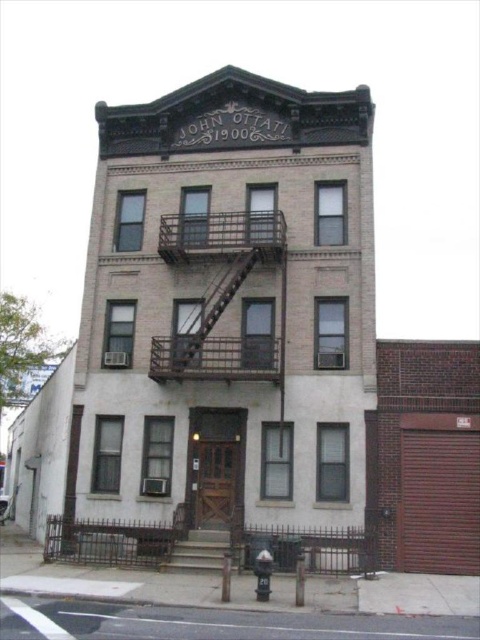
Measure the distance between point (241,264) and camera.

Point (241,264) and camera are 22.69 meters apart.

The width and height of the screenshot is (480, 640). Identify the location of metallic fire escape at center. (212, 308).